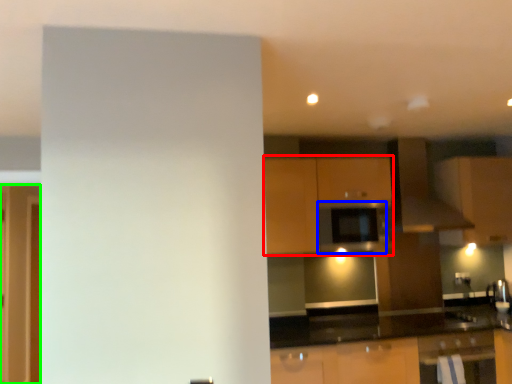
Question: Based on their relative distances, which object is nearer to cabinetry (highlighted by a red box)? Choose from appliance (highlighted by a blue box) and glass door (highlighted by a green box).

Choices:
 (A) appliance
 (B) glass door

Answer: (A)